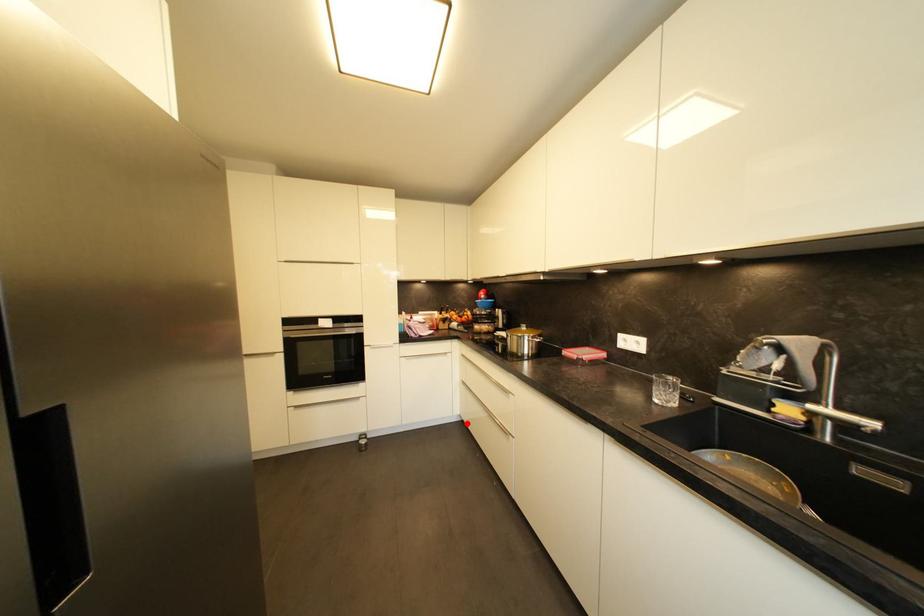
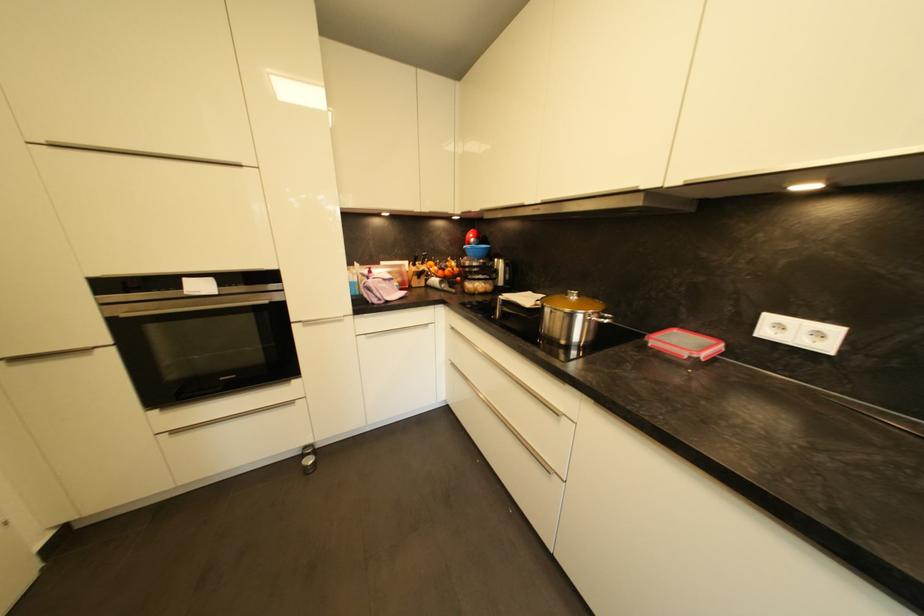
Question: I am providing you with two images of the same scene from different viewpoints. Given a red point in image1, look at the same physical point in image2. Is it:

Choices:
 (A) Closer to the viewpoint
 (B) Farther from the viewpoint

Answer: (B)